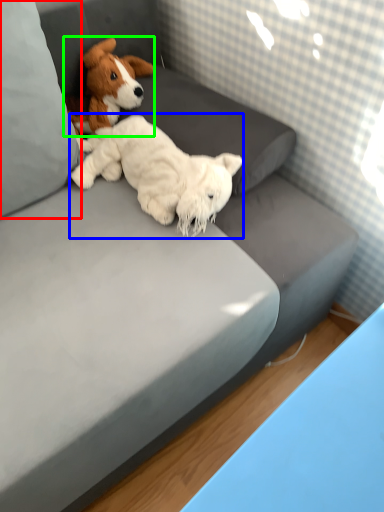
Question: Considering the real-world distances, which object is closest to pillow (highlighted by a red box)? dog (highlighted by a blue box) or dog (highlighted by a green box).

Choices:
 (A) dog
 (B) dog

Answer: (A)